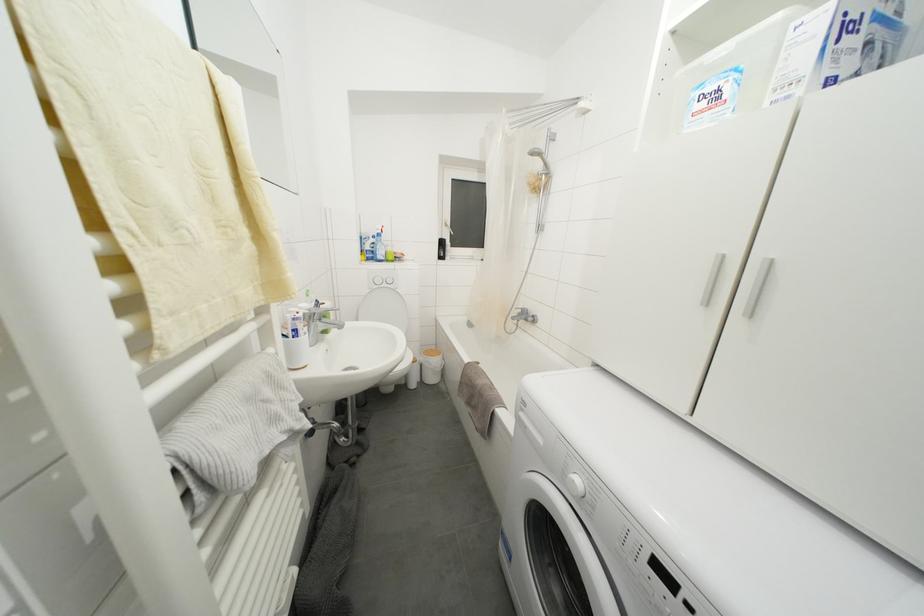
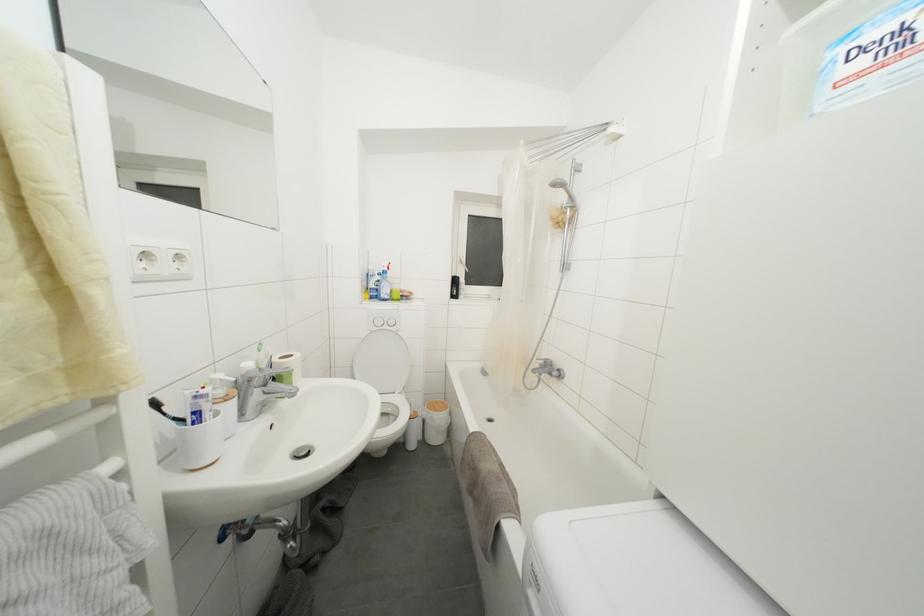
Question: Based on the continuous images, in which direction is the camera rotating? Reply with the corresponding letter.

Choices:
 (A) Left
 (B) Right
 (C) Up
 (D) Down

Answer: (C)